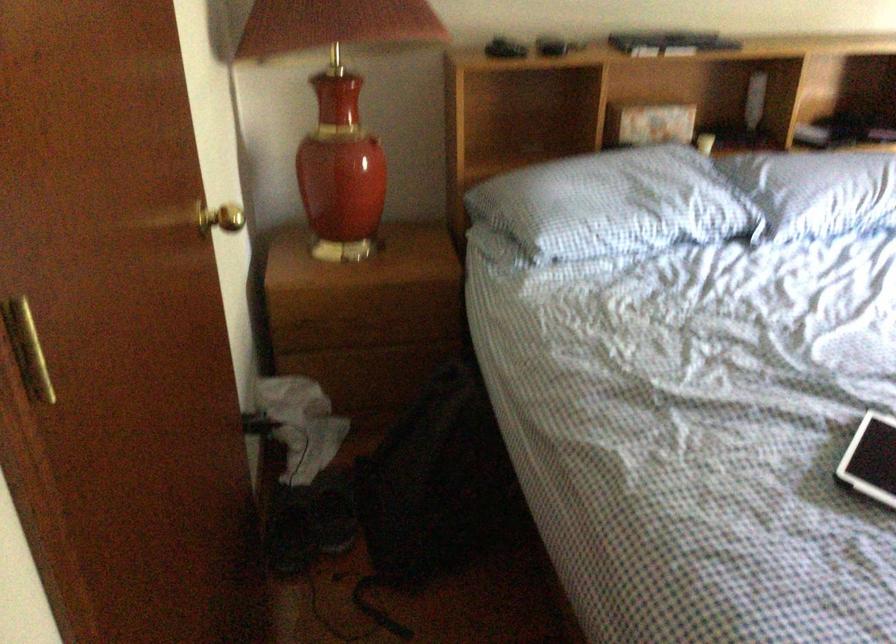
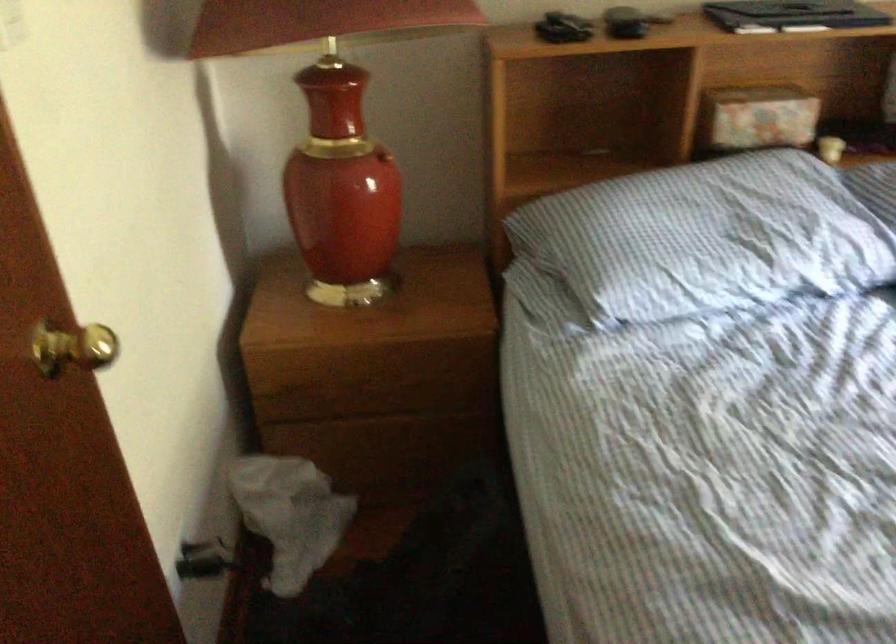
In the second image, find the point that corresponds to pixel 708 142 in the first image.

(830, 149)